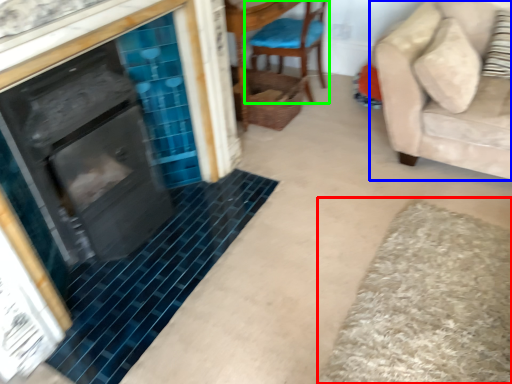
Question: Which object is positioned farthest from bath mat (highlighted by a red box)? Select from studio couch (highlighted by a blue box) and chair (highlighted by a green box).

Choices:
 (A) studio couch
 (B) chair

Answer: (B)